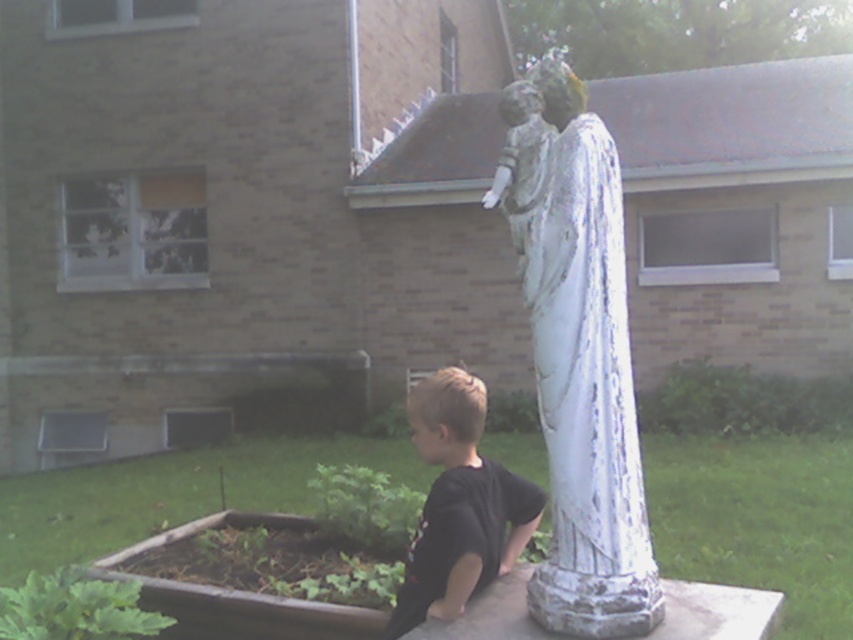
You are a gardener who needs to place a new flower pot between the white chipped paint statue at center and the brown wooden flower bed at lower left. Considering their heights, which object should the flower pot be placed closer to?

The flower pot should be placed closer to the brown wooden flower bed at lower left because the white chipped paint statue at center is taller, so placing the flower pot closer to the shorter object would ensure balance in the arrangement.

You are a maintenance worker tasked with inspecting statues in a park. You see the white cracked statue at lower right and the white chipped paint statue at center. According to the scene description, which statue is located to the left of the other?

The white cracked statue at lower right is positioned on the left side of the white chipped paint statue at center.